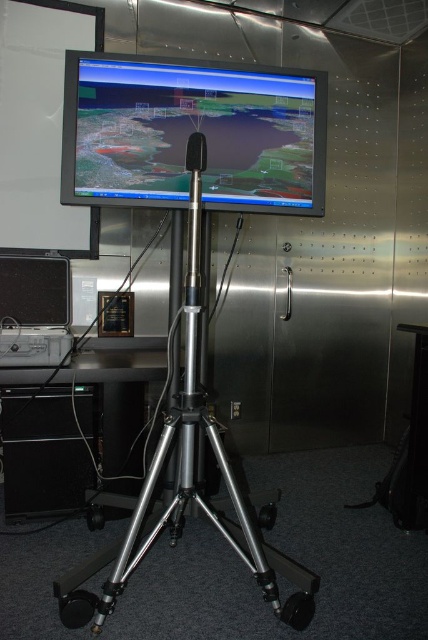
You are setting up a laptop for a flight simulation presentation. The black plastic computer desk at lower left is where you need to place it. Based on the coordinates provided, is the desk positioned closer to the left or right side of the room?

The black plastic computer desk at lower left is located at point (74, 429). Since the x coordinate is 0.672, which is closer to 1, it is positioned closer to the right side of the room.

You are setting up a new projector in the room and need to position it so that its light beam can reach the matte black monitor at center. According to the room layout, where should you place the projector relative to the monitor?

The matte black monitor at center is located at point (192,132). To project onto it, position the projector in a line of sight facing this coordinate, ensuring the beam can reach without obstruction.